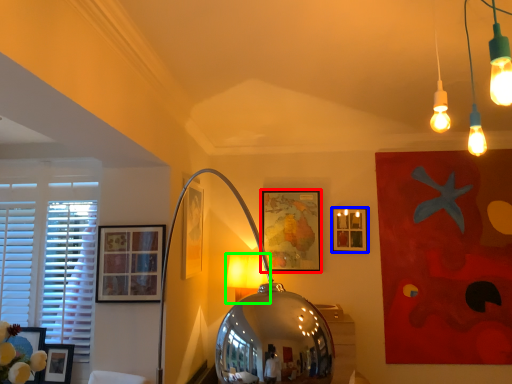
Question: Based on their relative distances, which object is farther from picture frame (highlighted by a red box)? Choose from picture frame (highlighted by a blue box) and table lamp (highlighted by a green box).

Choices:
 (A) picture frame
 (B) table lamp

Answer: (B)